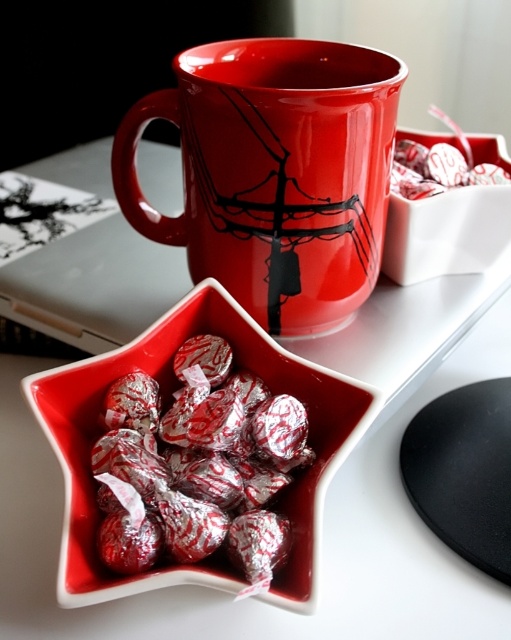
You are setting up a Valentine gift basket and need to place the glossy ceramic mug at upper center and the silver foil wrapped heart at center. According to the image, which object is on the left side?

The silver foil wrapped heart at center is on the left side because the glossy ceramic mug at upper center is positioned on the right side of it.

You are arranging a Valentine gift box and see the silver foil wrapped heart at center and the silver foil heart at center. Which one is closer to you?

The silver foil wrapped heart at center is closer to you because it is in front of the silver foil heart at center.